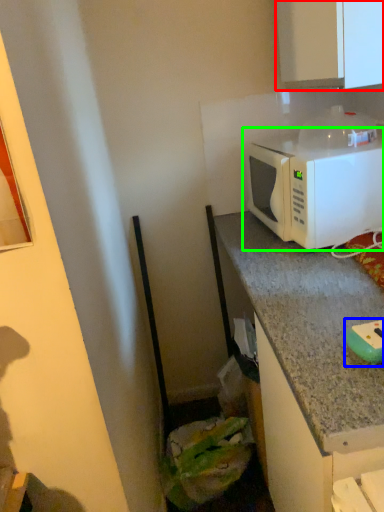
Question: Based on their relative distances, which object is farther from cabinetry (highlighted by a red box)? Choose from appliance (highlighted by a blue box) and microwave oven (highlighted by a green box).

Choices:
 (A) appliance
 (B) microwave oven

Answer: (A)